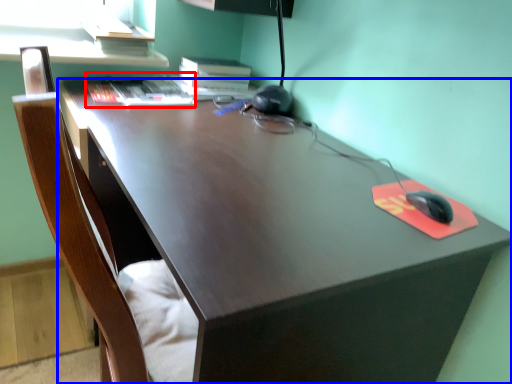
Question: Which of the following is the farthest to the observer, book (highlighted by a red box) or desk (highlighted by a blue box)?

Choices:
 (A) book
 (B) desk

Answer: (A)